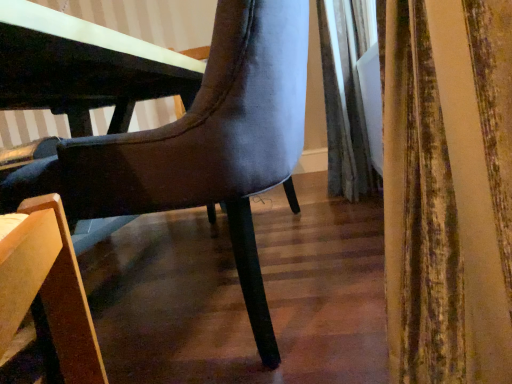
The height and width of the screenshot is (384, 512). Describe the element at coordinates (346, 97) in the screenshot. I see `velvet gray curtain at right` at that location.

Where is `velvet gray curtain at right`? velvet gray curtain at right is located at coordinates (346, 97).

Locate an element on the screen. suede-like gray chair at center is located at coordinates [202, 145].

Describe the element at coordinates (202, 145) in the screenshot. The height and width of the screenshot is (384, 512). I see `suede-like gray chair at center` at that location.

Locate an element on the screen. velvet gray curtain at right is located at coordinates (346, 97).

Does velvet gray curtain at right appear on the left side of suede-like gray chair at center?

No, velvet gray curtain at right is not to the left of suede-like gray chair at center.

Who is more distant, velvet gray curtain at right or suede-like gray chair at center?

velvet gray curtain at right is further from the camera.

Is point (341, 25) positioned in front of point (128, 212)?

No, it is behind (128, 212).

Looking at this image, from the image's perspective, which one is positioned higher, velvet gray curtain at right or suede-like gray chair at center?

velvet gray curtain at right appears higher in the image.

From a real-world perspective, is velvet gray curtain at right beneath suede-like gray chair at center?

Actually, velvet gray curtain at right is physically above suede-like gray chair at center in the real world.

Considering the sizes of objects velvet gray curtain at right and suede-like gray chair at center in the image provided, who is wider, velvet gray curtain at right or suede-like gray chair at center?

suede-like gray chair at center.

Can you confirm if velvet gray curtain at right is taller than suede-like gray chair at center?

Yes, velvet gray curtain at right is taller than suede-like gray chair at center.

From the picture: Can you confirm if velvet gray curtain at right is bigger than suede-like gray chair at center?

Result: No, velvet gray curtain at right is not bigger than suede-like gray chair at center.

Do you think velvet gray curtain at right is within suede-like gray chair at center, or outside of it?

The correct answer is: outside.

Is velvet gray curtain at right placed right next to suede-like gray chair at center?

No, velvet gray curtain at right is not with suede-like gray chair at center.

Is suede-like gray chair at center at the back of velvet gray curtain at right?

velvet gray curtain at right does not have its back to suede-like gray chair at center.

What's the angular difference between velvet gray curtain at right and suede-like gray chair at center's facing directions?

There is a 6.13-degree angle between the facing directions of velvet gray curtain at right and suede-like gray chair at center.

At what (x,y) coordinates should I click in order to perform the action: click on chair below the velvet gray curtain at right (from the image's perspective). Please return your answer as a coordinate pair (x, y). This screenshot has width=512, height=384. Looking at the image, I should click on (202, 145).

Looking at this image, between suede-like gray chair at center and velvet gray curtain at right, which one appears on the left side from the viewer's perspective?

suede-like gray chair at center.

Based on the photo, is suede-like gray chair at center in front of velvet gray curtain at right?

That is True.

Is point (214, 124) behind point (331, 168)?

No.

From the image's perspective, is suede-like gray chair at center on top of velvet gray curtain at right?

No, from the image's perspective, suede-like gray chair at center is not over velvet gray curtain at right.

From a real-world perspective, does suede-like gray chair at center sit lower than velvet gray curtain at right?

Yes.

Consider the image. Between suede-like gray chair at center and velvet gray curtain at right, which one has larger width?

suede-like gray chair at center.

Who is shorter, suede-like gray chair at center or velvet gray curtain at right?

suede-like gray chair at center.

Considering the sizes of suede-like gray chair at center and velvet gray curtain at right in the image, is suede-like gray chair at center bigger or smaller than velvet gray curtain at right?

Considering their sizes, suede-like gray chair at center takes up more space than velvet gray curtain at right.

Consider the image. Choose the correct answer: Is suede-like gray chair at center inside velvet gray curtain at right or outside it?

suede-like gray chair at center is located beyond the bounds of velvet gray curtain at right.

Is suede-like gray chair at center far away from velvet gray curtain at right?

Indeed, suede-like gray chair at center is not near velvet gray curtain at right.

Is suede-like gray chair at center facing towards velvet gray curtain at right?

No, suede-like gray chair at center is not oriented towards velvet gray curtain at right.

Measure the distance between suede-like gray chair at center and velvet gray curtain at right.

They are 1.19 meters apart.

Locate an element on the screen. The image size is (512, 384). curtain that is behind the suede-like gray chair at center is located at coordinates (346, 97).

In the image, there is a velvet gray curtain at right. At what (x,y) coordinates should I click in order to perform the action: click on chair below it (from the image's perspective). Please return your answer as a coordinate pair (x, y). The image size is (512, 384). Looking at the image, I should click on (202, 145).

Image resolution: width=512 pixels, height=384 pixels. In order to click on curtain above the suede-like gray chair at center (from a real-world perspective) in this screenshot , I will do `click(346, 97)`.